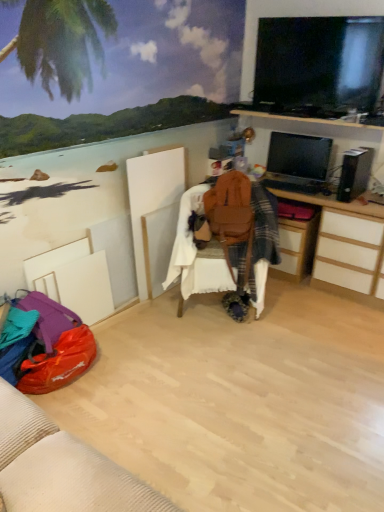
Question: Considering the relative sizes of brown leather bean bag chair at center and wooden drawer at center-right in the image provided, is brown leather bean bag chair at center bigger than wooden drawer at center-right?

Choices:
 (A) yes
 (B) no

Answer: (A)

Question: Can you confirm if brown leather bean bag chair at center is positioned to the right of wooden drawer at center-right?

Choices:
 (A) yes
 (B) no

Answer: (B)

Question: Is brown leather bean bag chair at center looking in the opposite direction of wooden drawer at center-right?

Choices:
 (A) yes
 (B) no

Answer: (B)

Question: Is brown leather bean bag chair at center facing towards wooden drawer at center-right?

Choices:
 (A) no
 (B) yes

Answer: (A)

Question: Is brown leather bean bag chair at center positioned before wooden drawer at center-right?

Choices:
 (A) no
 (B) yes

Answer: (B)

Question: Visually, is wooden computer desk at center right positioned to the left or to the right of brown leather bean bag chair at center?

Choices:
 (A) left
 (B) right

Answer: (B)

Question: From a real-world perspective, is wooden computer desk at center right physically located above or below brown leather bean bag chair at center?

Choices:
 (A) below
 (B) above

Answer: (A)

Question: From their relative heights in the image, would you say wooden computer desk at center right is taller or shorter than brown leather bean bag chair at center?

Choices:
 (A) short
 (B) tall

Answer: (A)

Question: Looking at the image, does wooden computer desk at center right seem bigger or smaller compared to brown leather bean bag chair at center?

Choices:
 (A) small
 (B) big

Answer: (B)

Question: Is wooden drawer at center-right wider or thinner than brown leather bean bag chair at center?

Choices:
 (A) wide
 (B) thin

Answer: (B)

Question: Is wooden drawer at center-right bigger or smaller than brown leather bean bag chair at center?

Choices:
 (A) small
 (B) big

Answer: (A)

Question: Is wooden drawer at center-right inside or outside of brown leather bean bag chair at center?

Choices:
 (A) outside
 (B) inside

Answer: (A)

Question: Is point (301, 243) positioned closer to the camera than point (188, 256)?

Choices:
 (A) closer
 (B) farther

Answer: (B)

Question: From the image's perspective, is brown leather bean bag chair at center above or below black glossy flat-screen tv at upper right, which appears as the first television when viewed from the top?

Choices:
 (A) below
 (B) above

Answer: (A)

Question: Considering the positions of brown leather bean bag chair at center and black glossy flat-screen tv at upper right, which appears as the first television when viewed from the top, in the image, is brown leather bean bag chair at center bigger or smaller than black glossy flat-screen tv at upper right, which appears as the first television when viewed from the top,?

Choices:
 (A) small
 (B) big

Answer: (B)